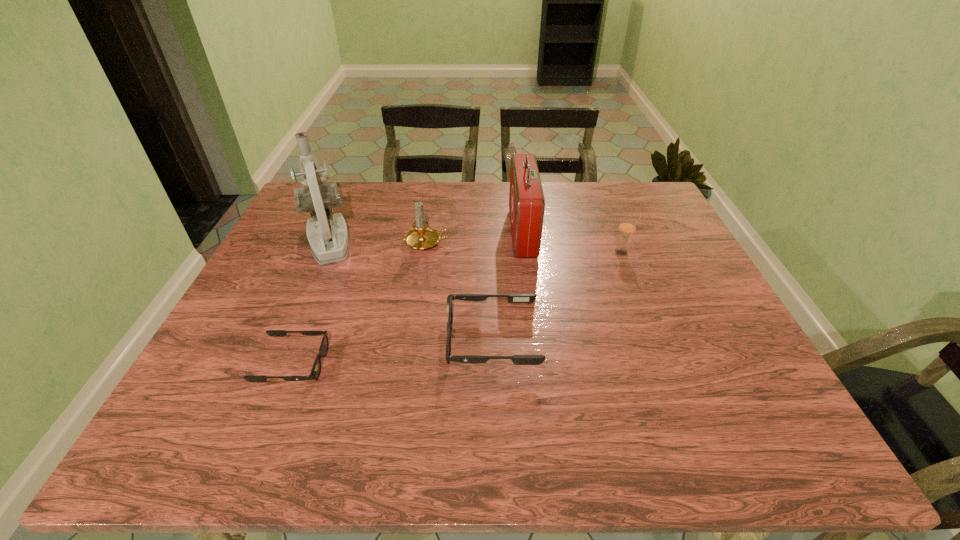
Find the location of `the left sunglasses`. the left sunglasses is located at coordinates (316, 369).

Locate an element on the screen. The width and height of the screenshot is (960, 540). the shortest object is located at coordinates (316, 369).

Where is `the second shortest object`? This screenshot has width=960, height=540. the second shortest object is located at coordinates (513, 298).

The height and width of the screenshot is (540, 960). Find the location of `the taller sunglasses`. the taller sunglasses is located at coordinates (513, 298).

This screenshot has height=540, width=960. Find the location of `the fifth shortest object`. the fifth shortest object is located at coordinates (526, 198).

The image size is (960, 540). Identify the location of candle. (421, 237).

Locate an element on the screen. The height and width of the screenshot is (540, 960). the tallest object is located at coordinates (328, 244).

Identify the location of the rightmost object. Image resolution: width=960 pixels, height=540 pixels. (627, 227).

This screenshot has width=960, height=540. What are the coordinates of `free space located 0.090m on the temples of the shortest object` in the screenshot? It's located at (368, 364).

Image resolution: width=960 pixels, height=540 pixels. Find the location of `vacant space situated 0.300m on the temples of the right sunglasses`. vacant space situated 0.300m on the temples of the right sunglasses is located at coordinates (314, 341).